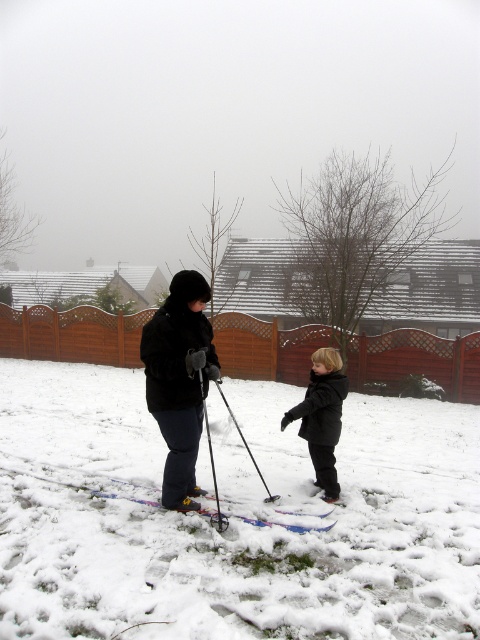
Question: From the image, what is the correct spatial relationship of black fuzzy coat at center in relation to metallic silver ski pole at center?

Choices:
 (A) above
 (B) below

Answer: (A)

Question: Which point is closer to the camera?

Choices:
 (A) white fluffy snow at center
 (B) black fuzzy coat at center
 (C) purple glossy skis at center

Answer: (A)

Question: Which point is closer to the camera?

Choices:
 (A) (257, 467)
 (B) (175, 342)
 (C) (220, 520)
 (D) (314, 435)

Answer: (B)

Question: Can you confirm if matte black ski at center is smaller than metallic silver ski pole at center?

Choices:
 (A) yes
 (B) no

Answer: (B)

Question: Is matte black ski at center to the right of purple glossy skis at center from the viewer's perspective?

Choices:
 (A) no
 (B) yes

Answer: (A)

Question: Which point appears farthest from the camera in this image?

Choices:
 (A) (109, 492)
 (B) (416, 621)
 (C) (323, 362)
 (D) (247, 445)

Answer: (D)